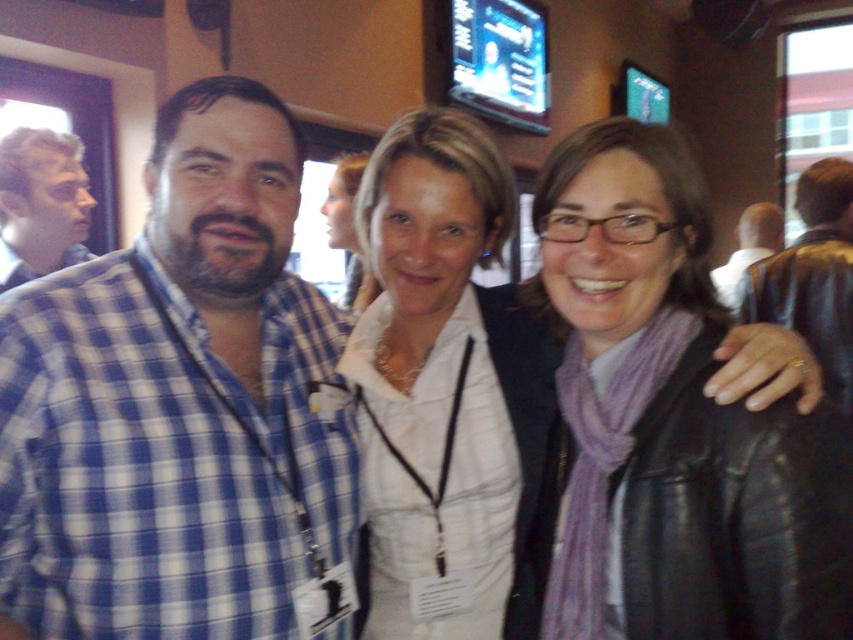
You are standing in the same room as the three people in the image. There are two points marked in the image. The first point is at coordinate point (4, 216) and the second point is at coordinate point (724, 289). Which of these two points is physically closer to you?

Point (4, 216) is closer to the viewer than point (724, 289).

You are taking a photo of the three people in the scene. You want to focus on the person closest to the camera. Which point should you focus on, point (x=805, y=490) or point (x=729, y=300)?

Point (x=805, y=490) is closer to the camera than point (x=729, y=300), so you should focus on point (x=805, y=490) to capture the person closest to the camera.

You are at a social event and want to compliment someone on their accessories. Which object is closer to the center of the image, the purple scarf at center or the light brown leather jacket at right?

The purple scarf at center is closer to the center of the image than the light brown leather jacket at right.